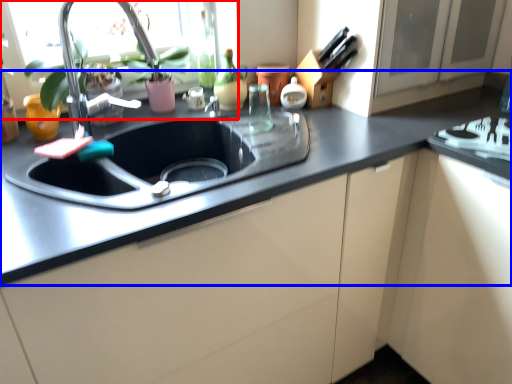
Question: Which object appears farthest to the camera in this image, window screen (highlighted by a red box) or countertop (highlighted by a blue box)?

Choices:
 (A) window screen
 (B) countertop

Answer: (A)